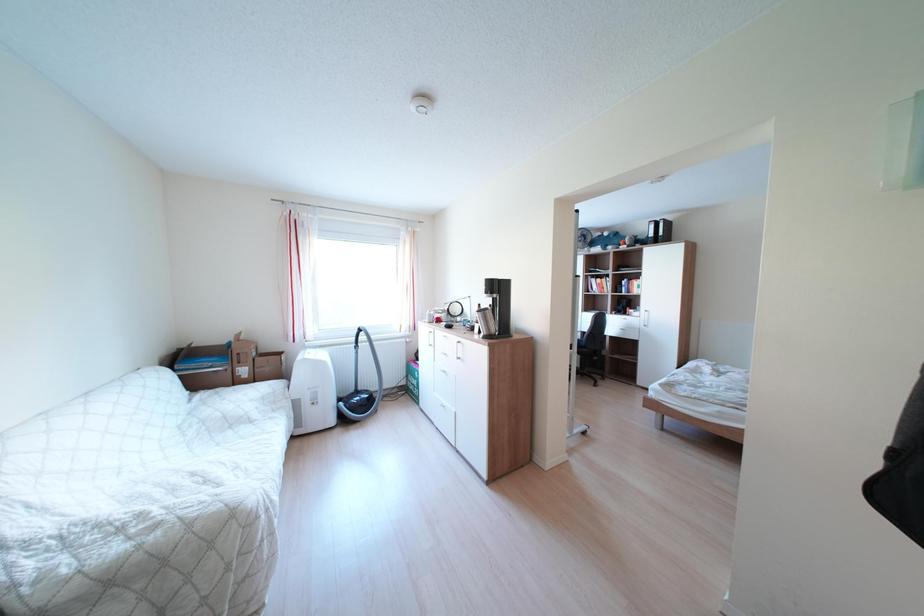
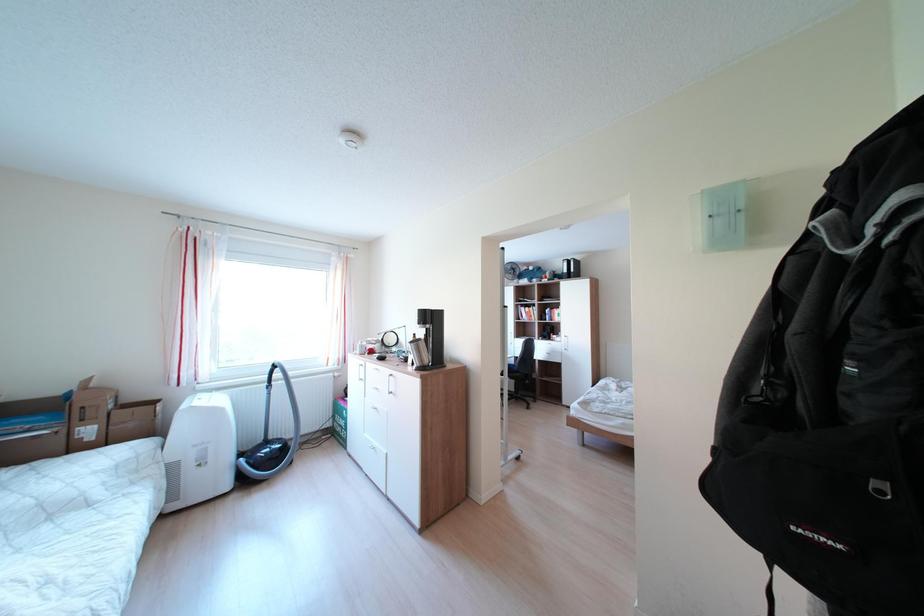
Question: The camera is either moving clockwise (left) or counter-clockwise (right) around the object. The first image is from the beginning of the video and the second image is from the end. Is the camera moving left or right when shooting the video?

Choices:
 (A) Left
 (B) Right

Answer: (A)